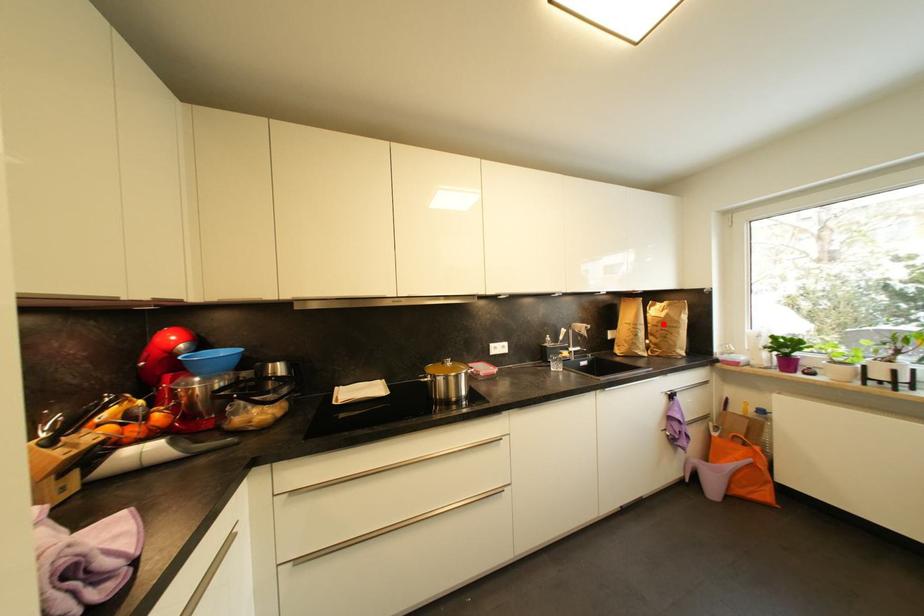
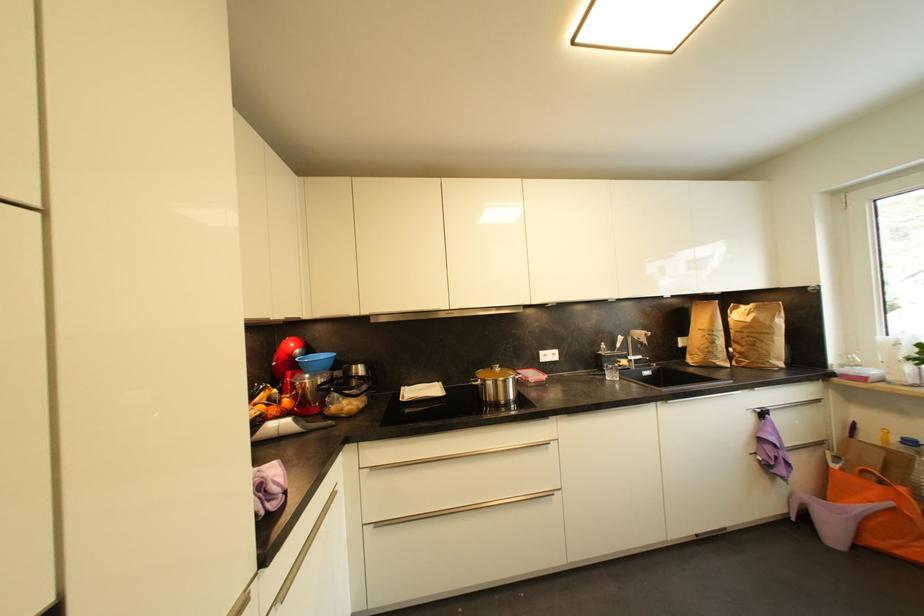
Find the pixel in the second image that matches the highlighted location in the first image.

(748, 330)